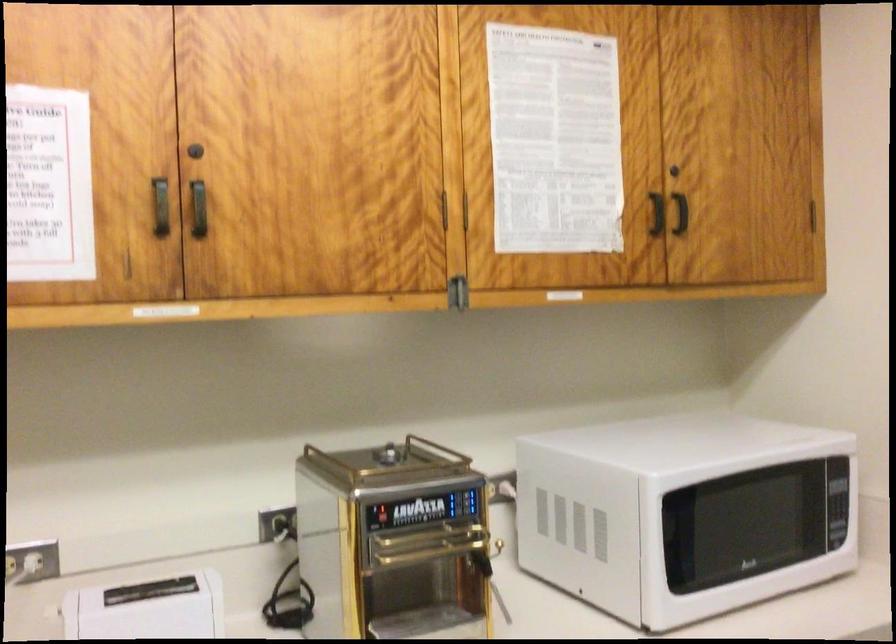
Describe the element at coordinates (752, 524) in the screenshot. I see `the microwave door handle` at that location.